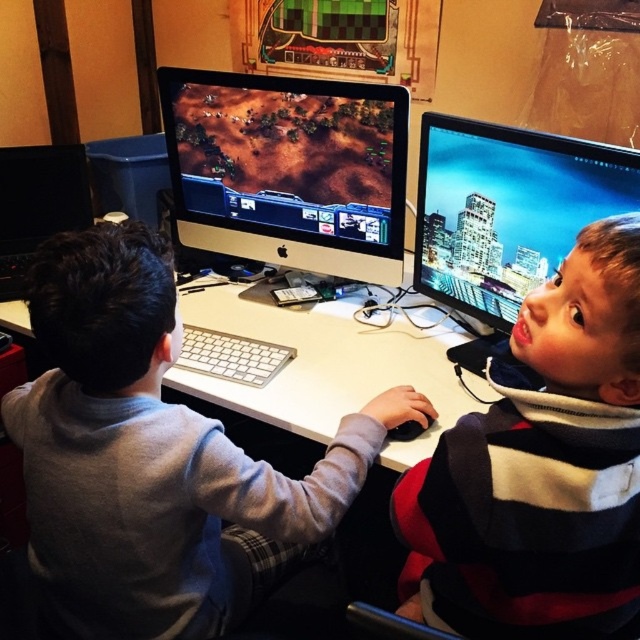
Question: Among these points, which one is farthest from the camera?

Choices:
 (A) (321, 106)
 (B) (435, 316)
 (C) (340, 467)
 (D) (492, 634)

Answer: (B)

Question: In this image, where is silver metallic computer at center located relative to black glossy monitor at left?

Choices:
 (A) above
 (B) below

Answer: (B)

Question: Which point appears closest to the camera in this image?

Choices:
 (A) (387, 332)
 (B) (83, 182)
 (C) (228, 365)

Answer: (C)

Question: Does striped sweater at upper right have a smaller size compared to shiny black monitor at right?

Choices:
 (A) no
 (B) yes

Answer: (A)

Question: Can you confirm if matte black monitor at center is positioned below white plastic keyboard at center?

Choices:
 (A) no
 (B) yes

Answer: (A)

Question: Among these objects, which one is nearest to the camera?

Choices:
 (A) gray fleece sweatshirt at center
 (B) white plastic keyboard at center

Answer: (A)